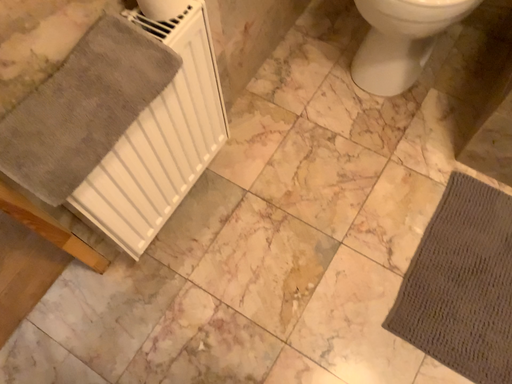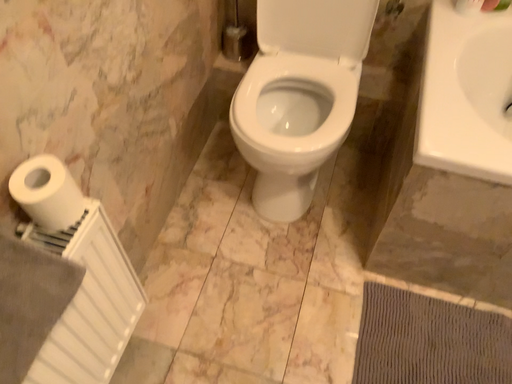
Question: Which way did the camera rotate in the video?

Choices:
 (A) rotated downward
 (B) rotated upward

Answer: (B)